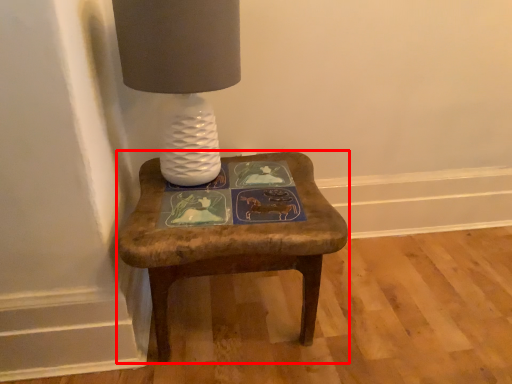
Question: Considering the relative positions of stool (annotated by the red box) and table lamp in the image provided, where is stool (annotated by the red box) located with respect to the staircase?

Choices:
 (A) left
 (B) right

Answer: (B)